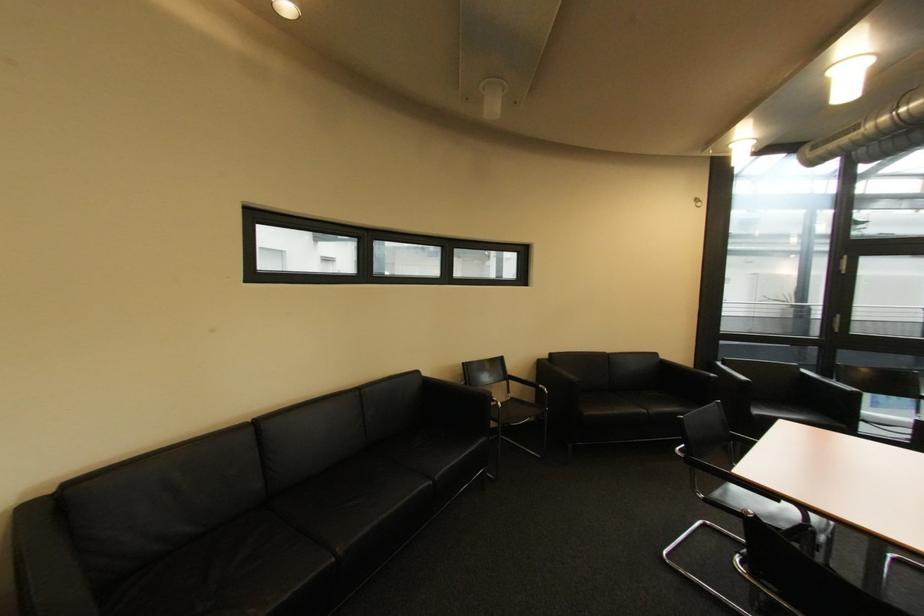
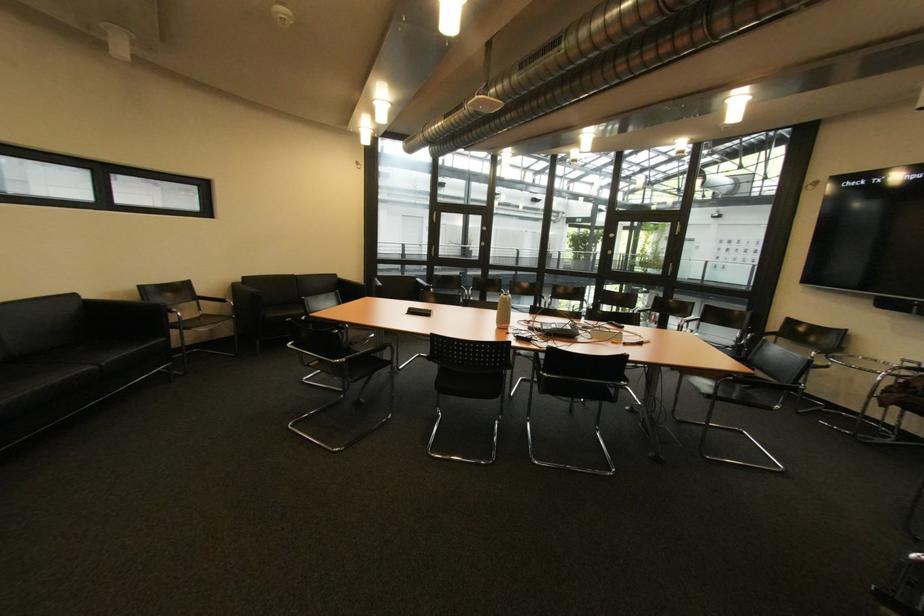
Where in the second image is the point corresponding to the point at 686,450 from the first image?

(312, 318)